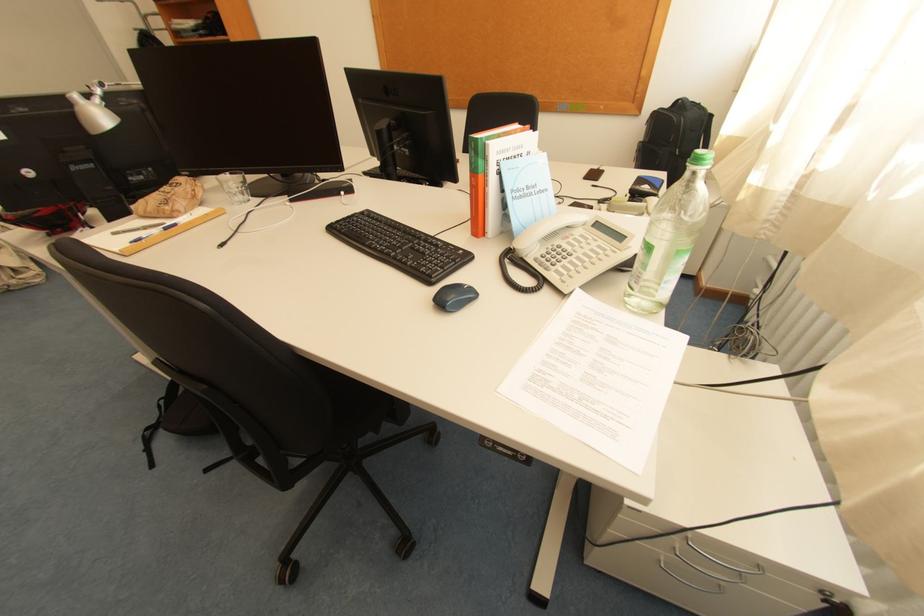
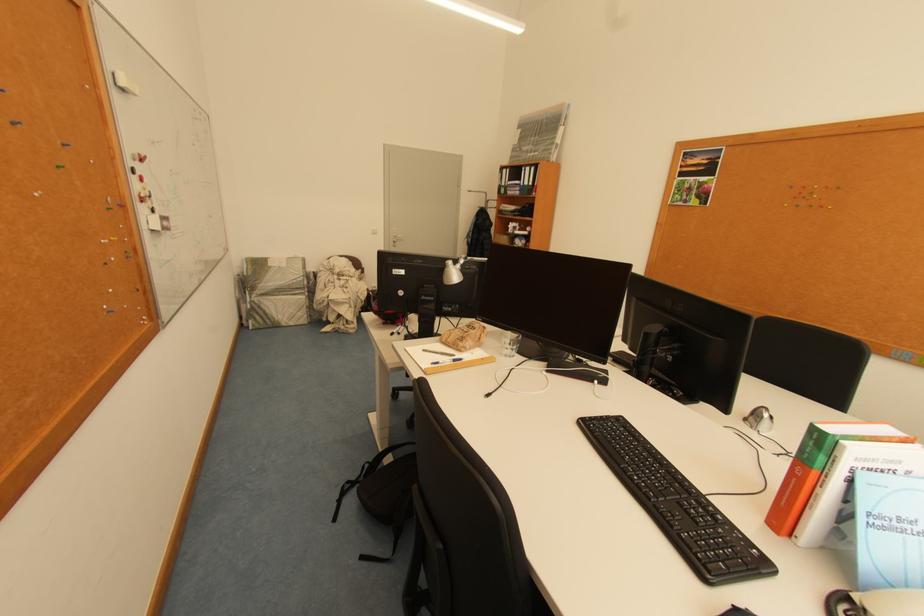
In the second image, find the point that corresponds to (x=496, y=147) in the first image.

(853, 448)